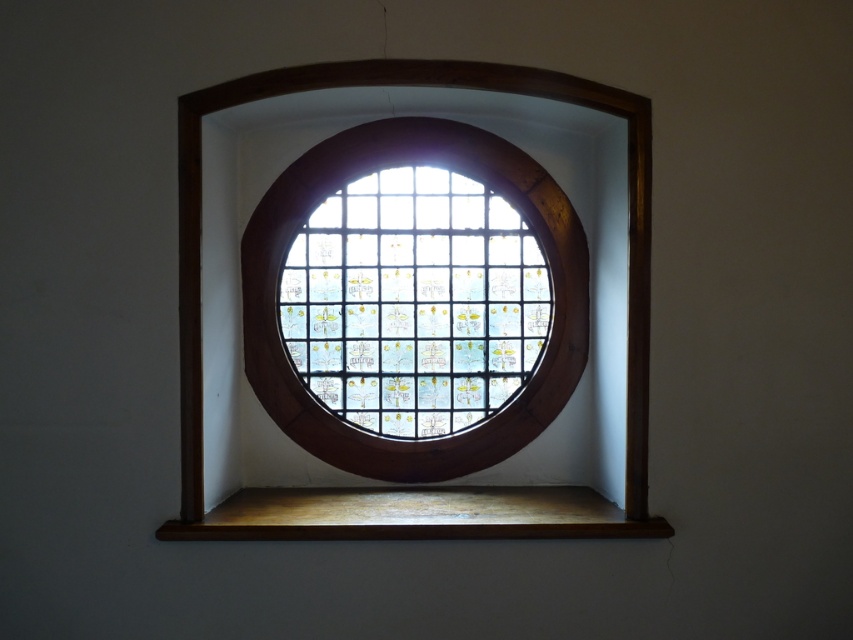
This screenshot has width=853, height=640. What do you see at coordinates (415, 301) in the screenshot?
I see `stained glass window at center` at bounding box center [415, 301].

Does stained glass window at center have a lesser width compared to brown wood frame at center?

Indeed, stained glass window at center has a lesser width compared to brown wood frame at center.

Which is in front, point (364, 400) or point (331, 508)?

Point (331, 508) is more forward.

Image resolution: width=853 pixels, height=640 pixels. Find the location of `stained glass window at center`. stained glass window at center is located at coordinates (415, 301).

Who is positioned more to the right, stained glass window at center or wooden at lower center?

Positioned to the right is wooden at lower center.

Is stained glass window at center to the left of wooden at lower center from the viewer's perspective?

Indeed, stained glass window at center is positioned on the left side of wooden at lower center.

Which is behind, point (407, 316) or point (590, 499)?

Positioned behind is point (407, 316).

Where is `stained glass window at center`? The width and height of the screenshot is (853, 640). stained glass window at center is located at coordinates (415, 301).

Can you confirm if brown wood frame at center is shorter than wooden at lower center?

No, brown wood frame at center is not shorter than wooden at lower center.

Can you confirm if brown wood frame at center is wider than wooden at lower center?

No, brown wood frame at center is not wider than wooden at lower center.

Who is more forward, (602,502) or (306,522)?

Point (306,522) is in front.

You are a GUI agent. You are given a task and a screenshot of the screen. Output one action in this format:
    pyautogui.click(x=<x>, y=<y>)
    Task: Click on the brown wood frame at center
    The height and width of the screenshot is (640, 853).
    Given the screenshot: What is the action you would take?
    pyautogui.click(x=416, y=490)